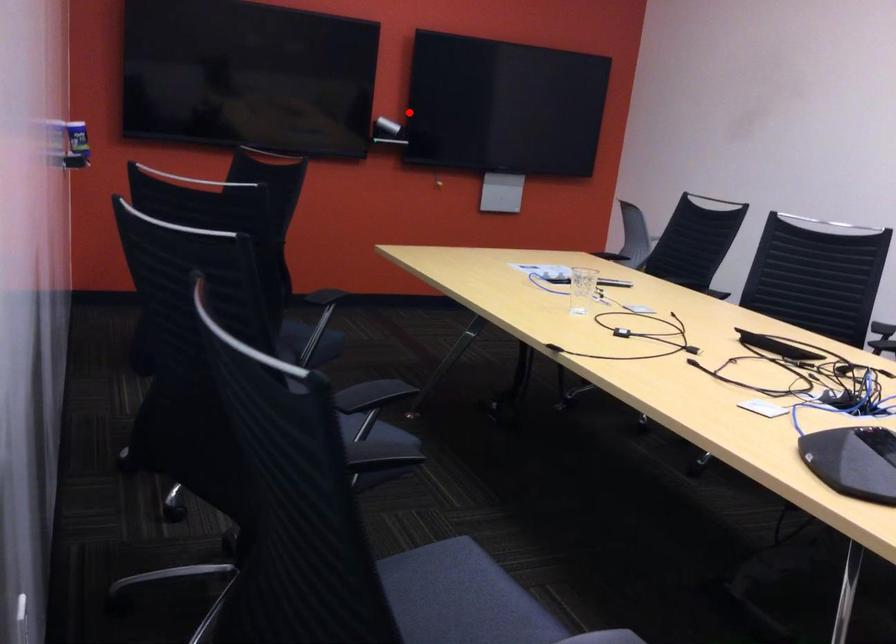
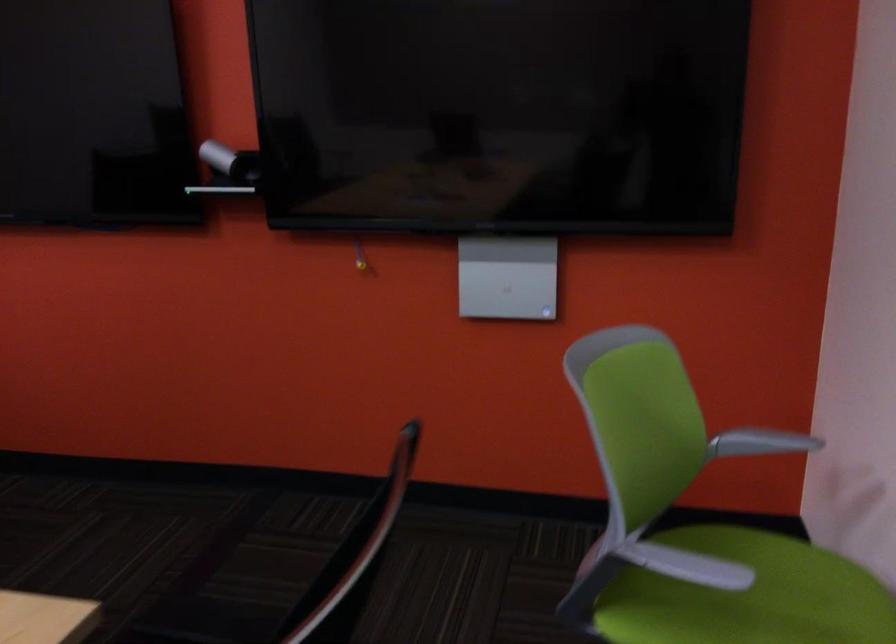
Question: I am providing you with two images of the same scene from different viewpoints. Image1 has a red point marked. In image2, the corresponding 3D location appears at what relative position? Reply with the corresponding letter.

Choices:
 (A) Closer
 (B) Farther

Answer: (A)